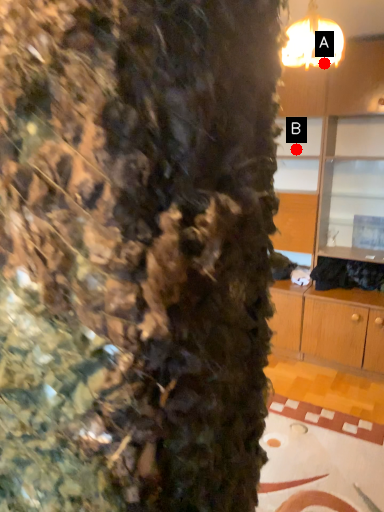
Question: Two points are circled on the image, labeled by A and B beside each circle. Which point is closer to the camera taking this photo?

Choices:
 (A) A is closer
 (B) B is closer

Answer: (A)